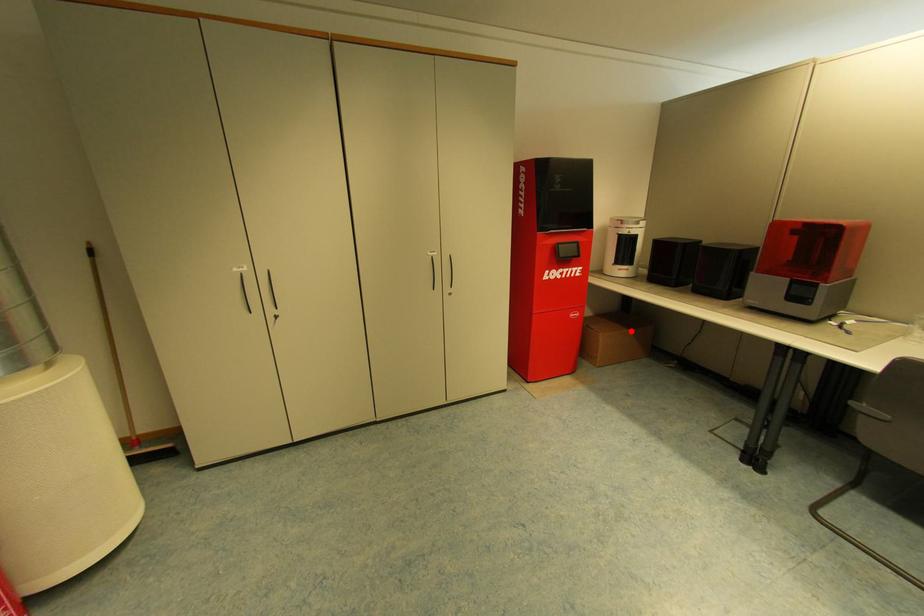
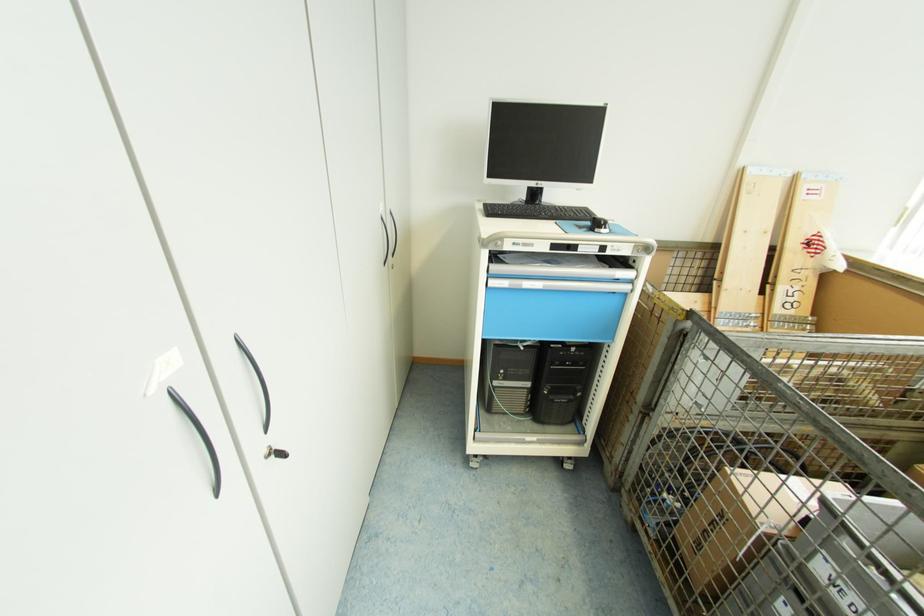
Question: I am providing you with two images of the same scene from different viewpoints. A red point is marked on the first image. At the location where the point appears in image 1, is it still visible in image 2?

Choices:
 (A) Yes
 (B) No

Answer: (B)